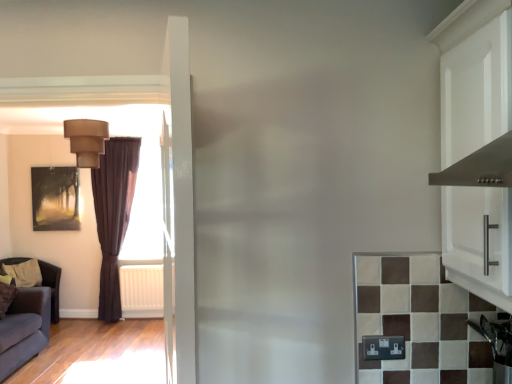
Question: Is white plastic radiator at left shorter than matte black painting at left?

Choices:
 (A) yes
 (B) no

Answer: (A)

Question: Does white plastic radiator at left have a smaller size compared to matte black painting at left?

Choices:
 (A) yes
 (B) no

Answer: (B)

Question: Considering the relative sizes of white plastic radiator at left and matte black painting at left in the image provided, is white plastic radiator at left thinner than matte black painting at left?

Choices:
 (A) no
 (B) yes

Answer: (A)

Question: From the image's perspective, does white plastic radiator at left appear lower than matte black painting at left?

Choices:
 (A) no
 (B) yes

Answer: (B)

Question: Is matte black painting at left located within white plastic radiator at left?

Choices:
 (A) yes
 (B) no

Answer: (B)

Question: From the image's perspective, is white plastic radiator at left over matte black painting at left?

Choices:
 (A) yes
 (B) no

Answer: (B)

Question: Does matte black painting at left have a larger size compared to dark brown leather armchair at left?

Choices:
 (A) yes
 (B) no

Answer: (B)

Question: Is matte black painting at left facing towards dark brown leather armchair at left?

Choices:
 (A) no
 (B) yes

Answer: (A)

Question: Is matte black painting at left positioned with its back to dark brown leather armchair at left?

Choices:
 (A) yes
 (B) no

Answer: (B)

Question: From a real-world perspective, is matte black painting at left on dark brown leather armchair at left?

Choices:
 (A) no
 (B) yes

Answer: (B)

Question: Is matte black painting at left far away from dark brown leather armchair at left?

Choices:
 (A) no
 (B) yes

Answer: (A)

Question: Is matte black painting at left shorter than dark brown leather armchair at left?

Choices:
 (A) yes
 (B) no

Answer: (A)

Question: Is stainless steel oven at lower right completely or partially inside white plastic radiator at left?

Choices:
 (A) no
 (B) yes

Answer: (A)